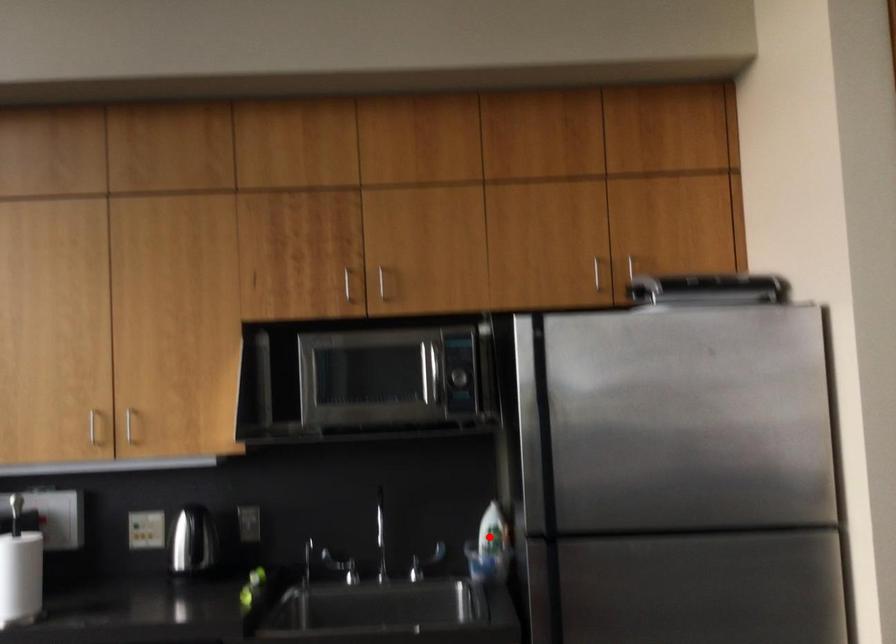
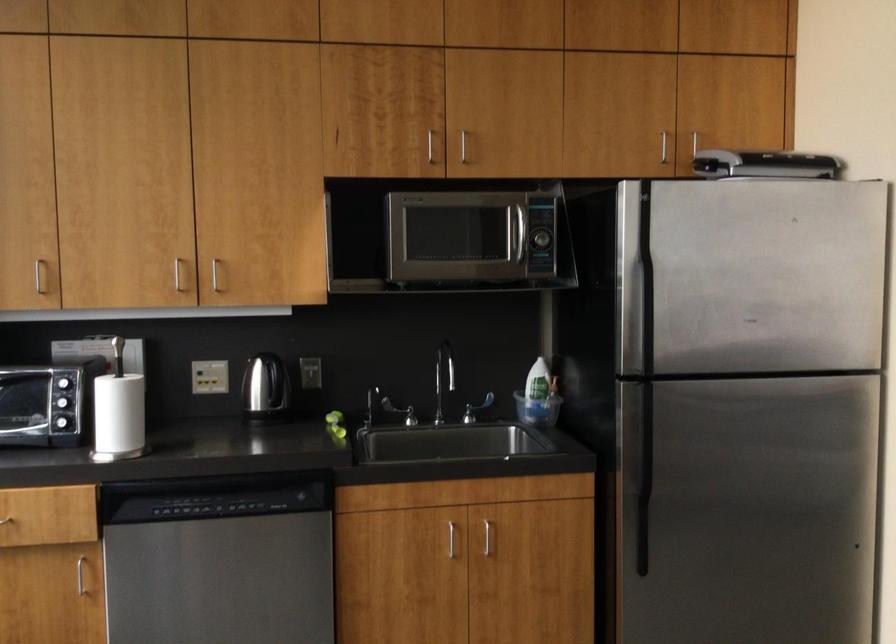
Question: I am providing you with two images of the same scene from different viewpoints. A red point is marked on the first image. Can you still see the location of the red point in image 2?

Choices:
 (A) Yes
 (B) No

Answer: (A)